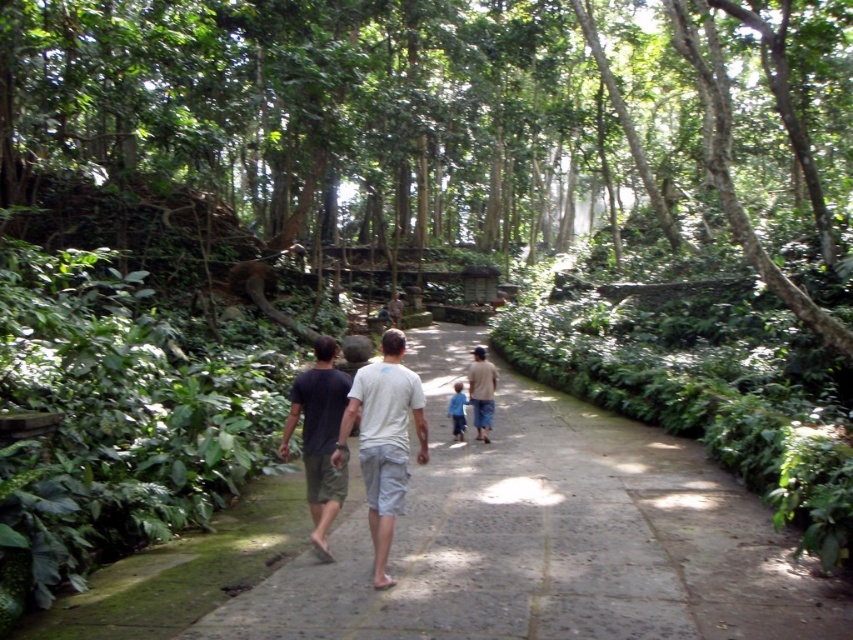
Which of these two, light brown fabric shirt at center or blue denim shorts at center, stands shorter?

light brown fabric shirt at center is shorter.

Is point (492, 394) positioned in front of point (463, 440)?

Yes.

Image resolution: width=853 pixels, height=640 pixels. Describe the element at coordinates (480, 392) in the screenshot. I see `light brown fabric shirt at center` at that location.

Locate an element on the screen. The image size is (853, 640). light brown fabric shirt at center is located at coordinates (480, 392).

Is point (418, 436) more distant than point (302, 452)?

No, (418, 436) is closer to viewer.

Which is behind, point (363, 435) or point (314, 464)?

Point (314, 464)

What are the coordinates of `white cotton shirt at center` in the screenshot? It's located at (384, 440).

Between point (613, 92) and point (381, 333), which one is positioned in front?

Positioned in front is point (381, 333).

Who is positioned more to the left, green leafy tree at center or white cotton shirt at center?

white cotton shirt at center is more to the left.

Locate an element on the screen. This screenshot has width=853, height=640. green leafy tree at center is located at coordinates (424, 136).